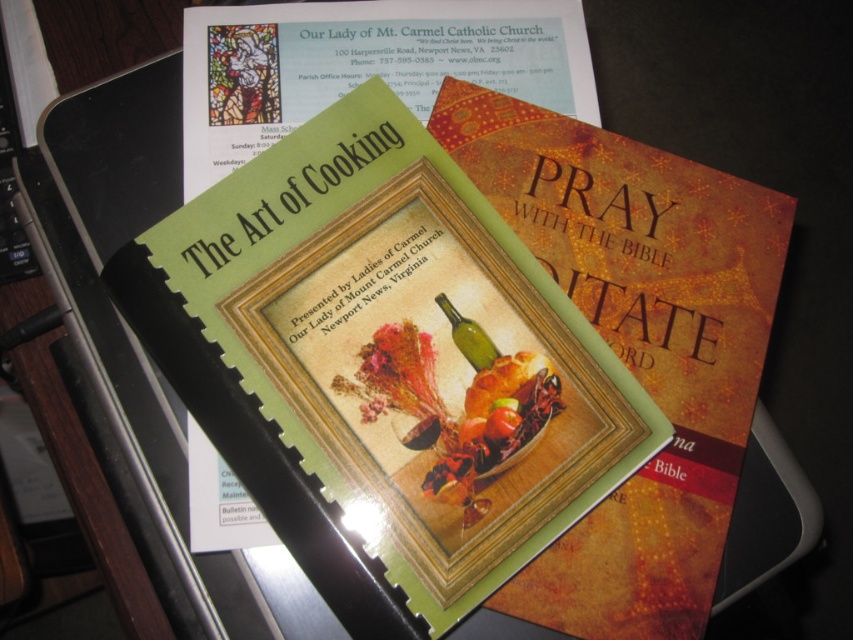
Question: Does green glass wine bottle at center appear on the right side of red matte tomato at center?

Choices:
 (A) no
 (B) yes

Answer: (A)

Question: Does green matte paper at center come behind green glass wine bottle at center?

Choices:
 (A) yes
 (B) no

Answer: (B)

Question: Can you confirm if matte orange book at center is wider than green glass wine bottle at center?

Choices:
 (A) no
 (B) yes

Answer: (B)

Question: Which of the following is the farthest from the observer?

Choices:
 (A) (486, 355)
 (B) (538, 502)
 (C) (517, 413)
 (D) (723, 568)

Answer: (D)

Question: Among these points, which one is nearest to the camera?

Choices:
 (A) (512, 420)
 (B) (331, 452)
 (C) (463, 353)
 (D) (695, 369)

Answer: (B)

Question: Which object is the closest to the matte orange book at center?

Choices:
 (A) green matte paper at center
 (B) green glass wine bottle at center

Answer: (A)